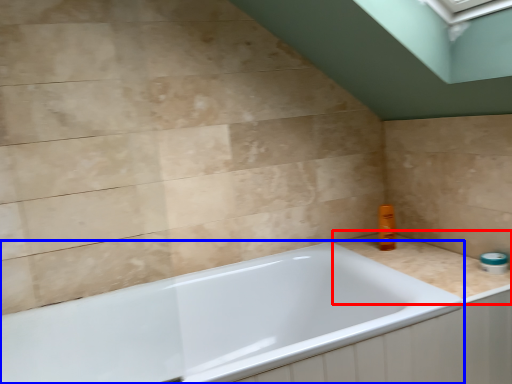
Question: Which of the following is the farthest to the observer, counter top (highlighted by a red box) or bathtub (highlighted by a blue box)?

Choices:
 (A) counter top
 (B) bathtub

Answer: (A)